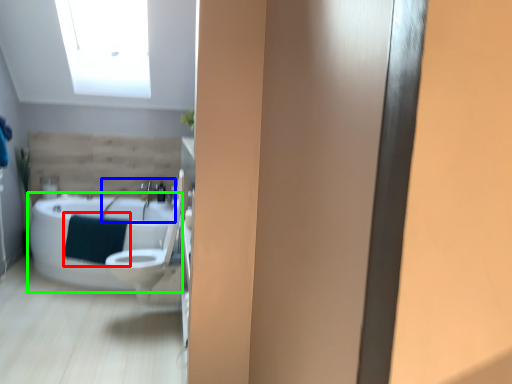
Question: Which object is positioned closest to bath towel (highlighted by a red box)? Select from sink (highlighted by a blue box) and bathtub (highlighted by a green box).

Choices:
 (A) sink
 (B) bathtub

Answer: (B)